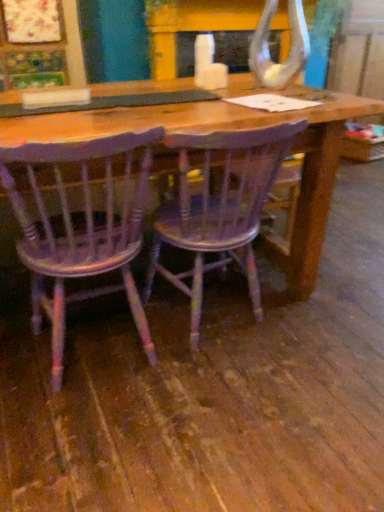
Find the location of `blank space situated above wooden chair at center, the second chair from the left (from a real-world perspective)`. blank space situated above wooden chair at center, the second chair from the left (from a real-world perspective) is located at coordinates (213, 114).